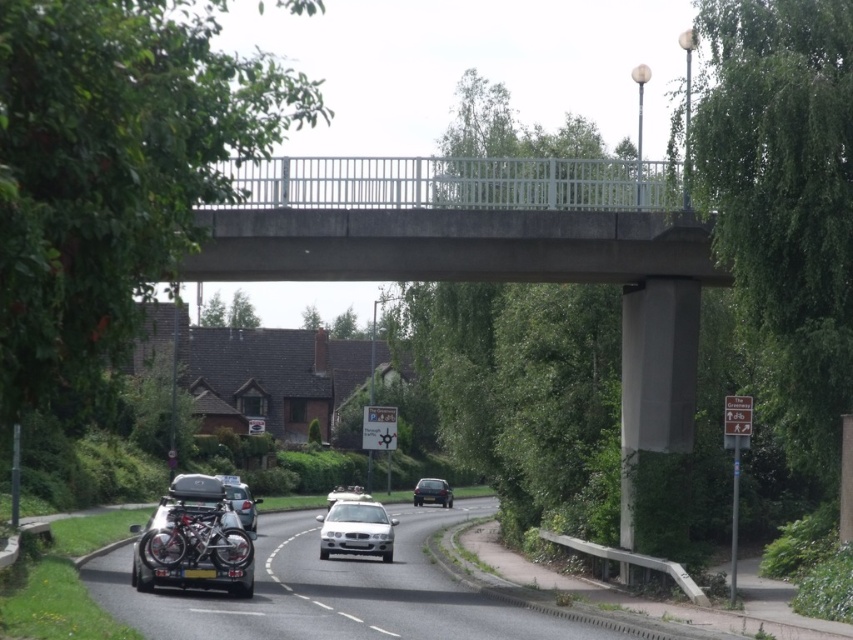
Question: Which of the following is the closest to the observer?

Choices:
 (A) (206, 577)
 (B) (250, 497)
 (C) (369, 554)
 (D) (361, 515)

Answer: (A)

Question: Which point is farther from the camera taking this photo?

Choices:
 (A) (494, 257)
 (B) (178, 508)
 (C) (418, 486)
 (D) (389, 522)

Answer: (C)

Question: Is white glossy car at center above black plastic license plate at center?

Choices:
 (A) no
 (B) yes

Answer: (A)

Question: Does satin silver sedan at center come behind white glossy car at center?

Choices:
 (A) no
 (B) yes

Answer: (A)

Question: Which point is farther from the camera taking this photo?

Choices:
 (A) (434, 484)
 (B) (202, 577)
 (C) (323, 228)
 (D) (352, 486)

Answer: (A)

Question: Can you confirm if concrete bridge at center is positioned above black plastic license plate at lower center?

Choices:
 (A) no
 (B) yes

Answer: (B)